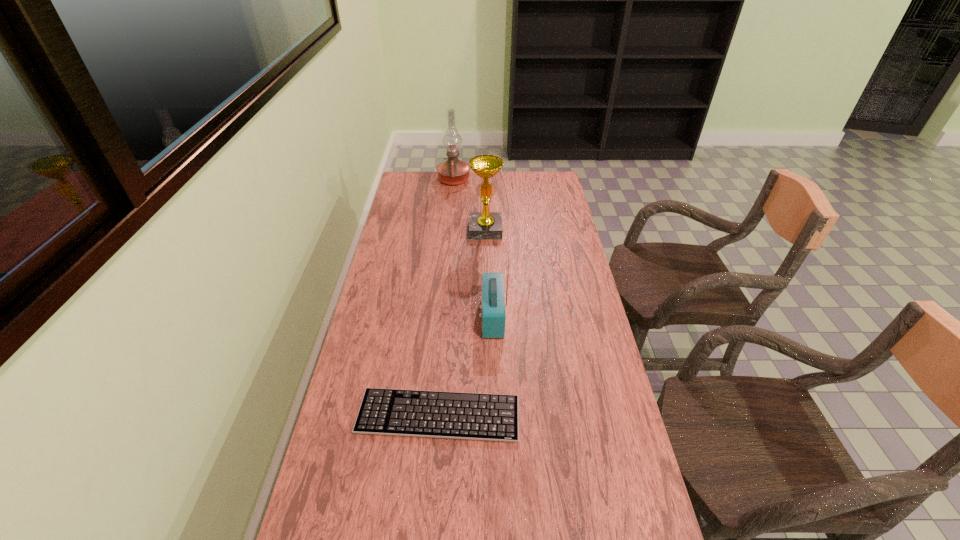
Where is `vacant space situated on the right of the nearest object`? vacant space situated on the right of the nearest object is located at coordinates (576, 415).

Find the location of a particular element. object located in the far edge section of the desktop is located at coordinates (453, 171).

I want to click on object at the left edge, so click(494, 417).

In the image, there is a desktop. Where is `vacant space at the far edge`? The width and height of the screenshot is (960, 540). vacant space at the far edge is located at coordinates (470, 182).

Where is `free space at the left edge of the desktop`? This screenshot has width=960, height=540. free space at the left edge of the desktop is located at coordinates point(321,526).

Identify the location of vacant space at the right edge of the desktop. The image size is (960, 540). (584, 490).

What are the coordinates of `vacant space at the far left corner of the desktop` in the screenshot? It's located at (434, 184).

Locate an element on the screen. This screenshot has width=960, height=540. vacant space at the far right corner of the desktop is located at coordinates (542, 191).

At what (x,y) coordinates should I click in order to perform the action: click on empty location between the shortest object and the second nearest object. Please return your answer as a coordinate pair (x, y). The width and height of the screenshot is (960, 540). Looking at the image, I should click on (466, 366).

At what (x,y) coordinates should I click in order to perform the action: click on empty space between the nearest object and the second farthest object. Please return your answer as a coordinate pair (x, y). Looking at the image, I should click on (462, 322).